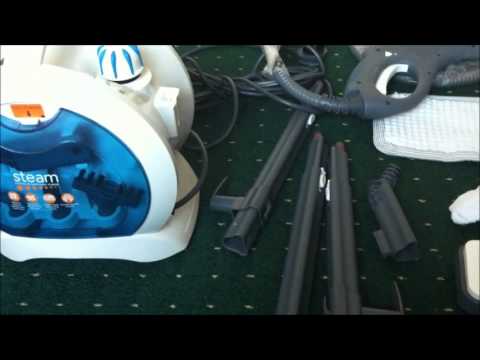
Identify the location of steam cleaner knob. This screenshot has height=360, width=480. (128, 71).